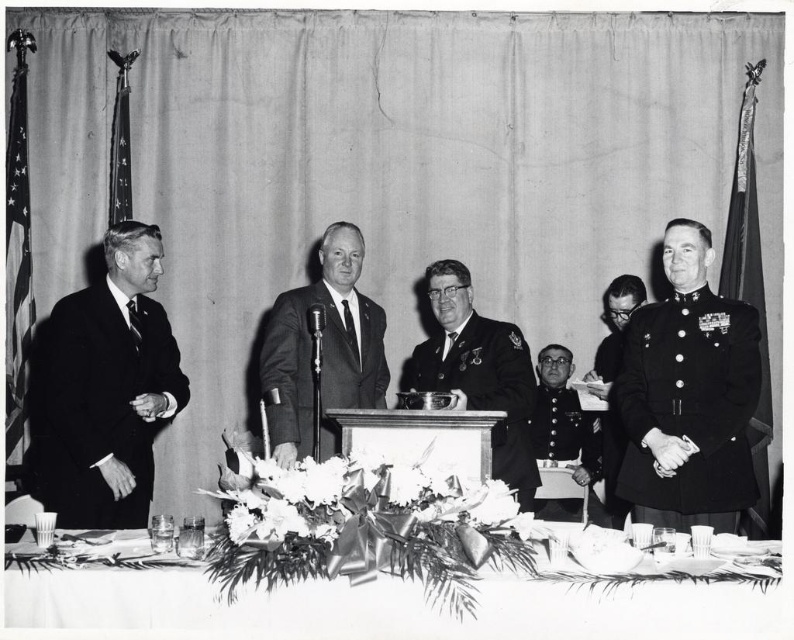
Question: Which object appears farthest from the camera in this image?

Choices:
 (A) uniform at center
 (B) white paper napkin at lower center
 (C) smooth black suit at center

Answer: (A)

Question: Is uniform at center bigger than uniformed military officer at right?

Choices:
 (A) no
 (B) yes

Answer: (A)

Question: Which of the following is the farthest from the observer?

Choices:
 (A) uniformed officer at center
 (B) uniformed military officer at right
 (C) uniform military at right

Answer: (B)

Question: Does uniform at right appear over uniform at center?

Choices:
 (A) no
 (B) yes

Answer: (B)

Question: Where is satin black suit at left located in relation to uniform at center in the image?

Choices:
 (A) left
 (B) right

Answer: (A)

Question: Which point is farther from the camera taking this photo?

Choices:
 (A) (442, 262)
 (B) (168, 413)
 (C) (599, 432)

Answer: (C)